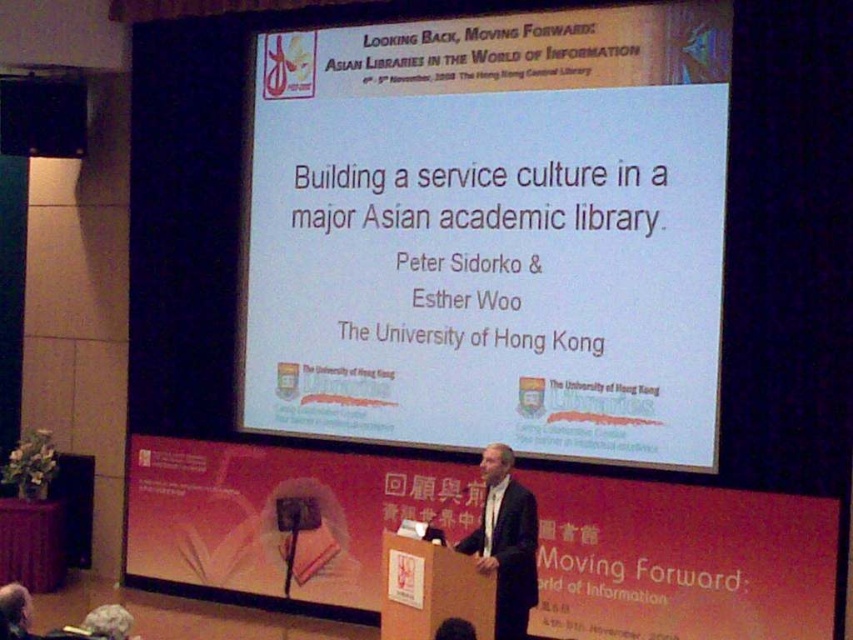
Question: Is white paper at center to the left of dark gray wool suit at center from the viewer's perspective?

Choices:
 (A) no
 (B) yes

Answer: (B)

Question: Among these points, which one is farthest from the camera?

Choices:
 (A) (553, 310)
 (B) (495, 534)

Answer: (A)

Question: Is the position of white paper at center less distant than that of dark gray wool suit at center?

Choices:
 (A) no
 (B) yes

Answer: (A)

Question: Does white paper at center have a lesser width compared to dark gray wool suit at center?

Choices:
 (A) yes
 (B) no

Answer: (B)